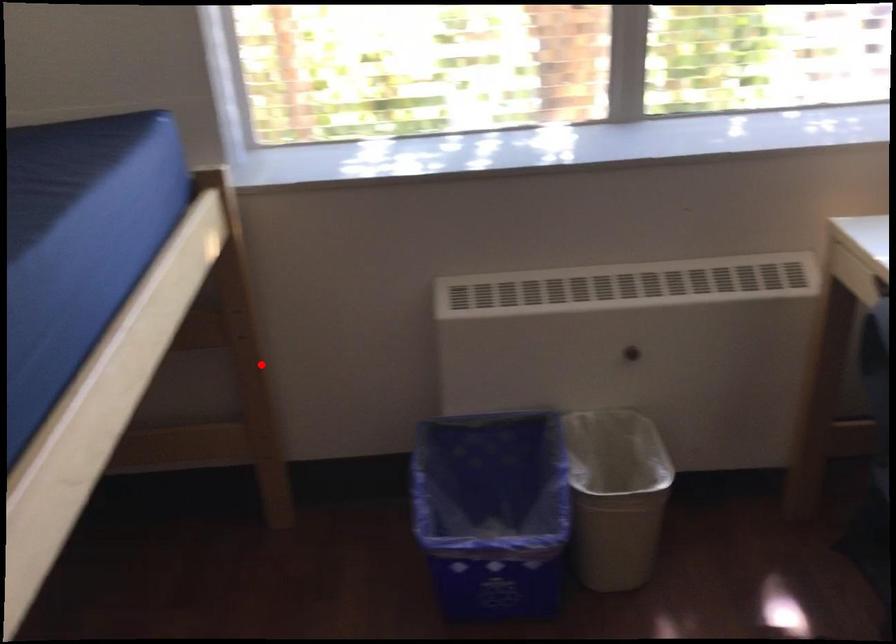
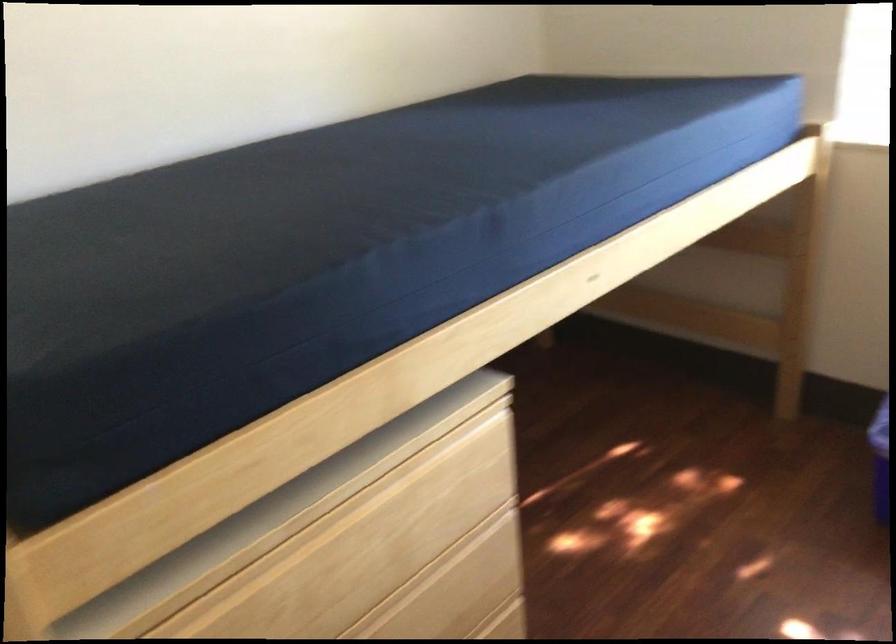
In the second image, find the point that corresponds to the highlighted location in the first image.

(803, 275)